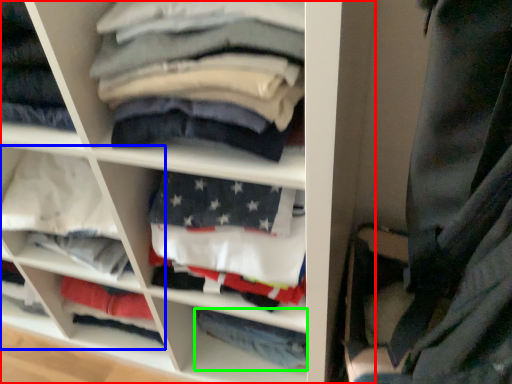
Question: Which object is positioned farthest from shelf (highlighted by a red box)? Select from cabinet (highlighted by a blue box) and trousers (highlighted by a green box).

Choices:
 (A) cabinet
 (B) trousers

Answer: (B)